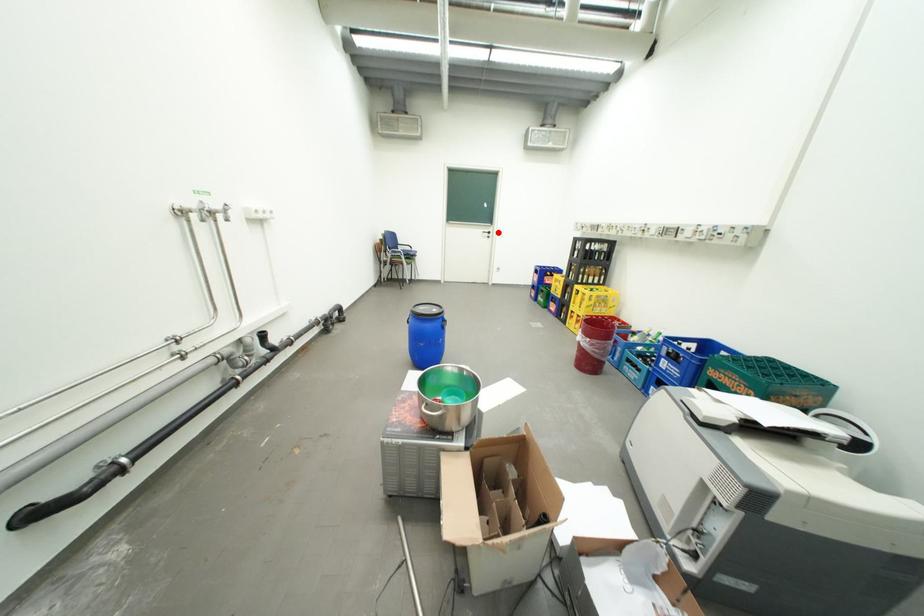
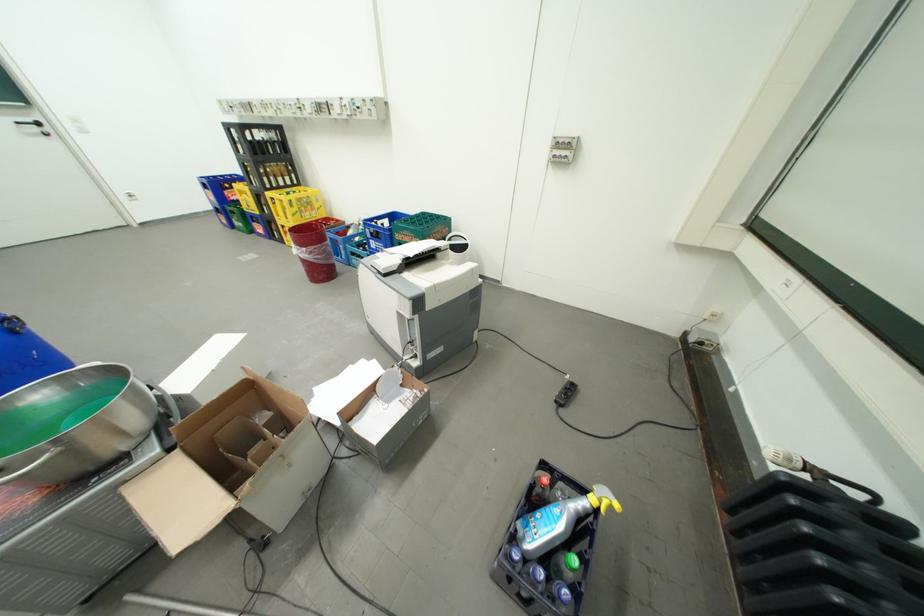
The point at the highlighted location is marked in the first image. Where is the corresponding point in the second image?

(41, 122)